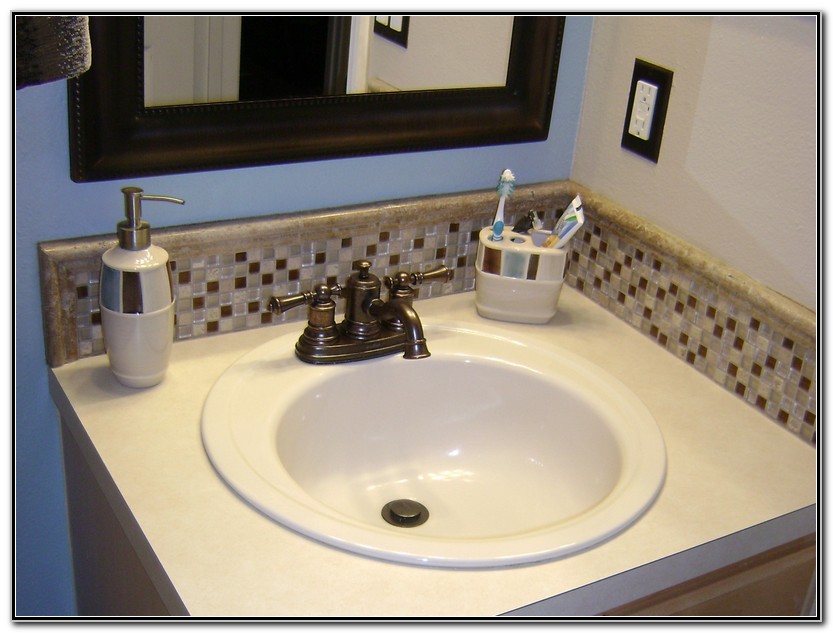
Locate an element on the screen. blue wall background is located at coordinates (55, 161).